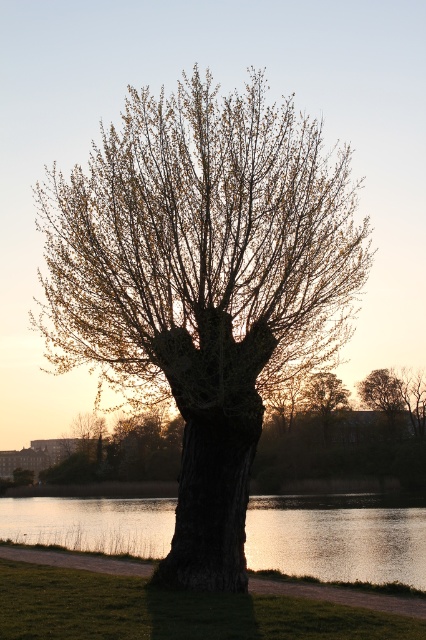
Between point (301, 145) and point (0, 532), which one is positioned behind?

Point (0, 532)

Is smooth bark tree at center in front of glistening water at tree right?

Yes, smooth bark tree at center is in front of glistening water at tree right.

Who is more forward, (183, 276) or (365, 497)?

Point (183, 276)

At what (x,y) coordinates should I click in order to perform the action: click on smooth bark tree at center. Please return your answer as a coordinate pair (x, y). The height and width of the screenshot is (640, 426). Looking at the image, I should click on (203, 284).